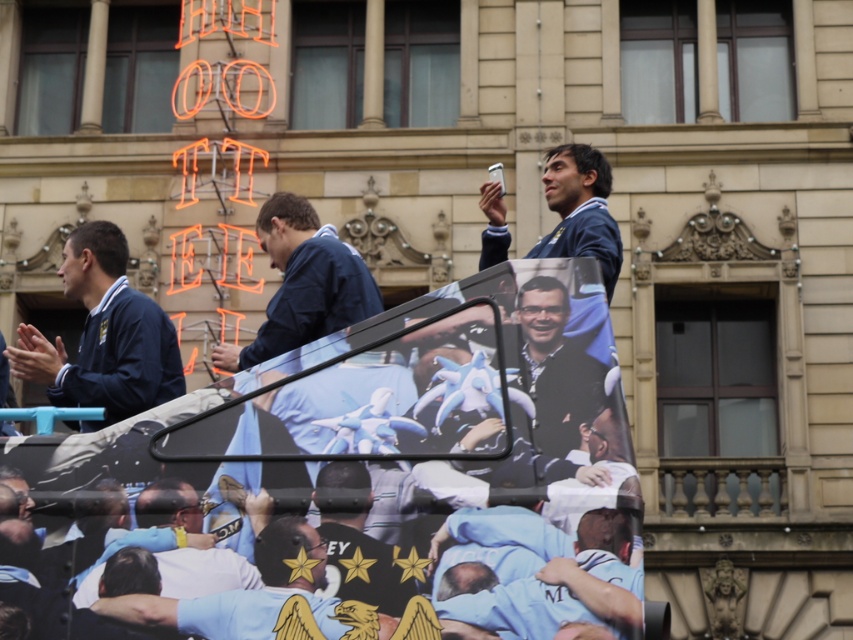
Can you confirm if blue fabric jacket at center is positioned below dark blue shirt at center?

Incorrect, blue fabric jacket at center is not positioned below dark blue shirt at center.

Is blue fabric jacket at center closer to camera compared to dark blue shirt at center?

No, blue fabric jacket at center is further to the viewer.

The width and height of the screenshot is (853, 640). What are the coordinates of `blue fabric jacket at center` in the screenshot? It's located at (302, 284).

Between dark blue shirt at center and blue fabric jacket at upper center, which one has more height?

blue fabric jacket at upper center is taller.

Can you confirm if dark blue shirt at center is positioned to the right of blue fabric jacket at upper center?

In fact, dark blue shirt at center is to the left of blue fabric jacket at upper center.

The image size is (853, 640). In order to click on dark blue shirt at center in this screenshot , I will do `click(556, 364)`.

Measure the distance from blue fabric banner at center to blue fabric jacket at center.

blue fabric banner at center and blue fabric jacket at center are 6.05 meters apart from each other.

This screenshot has height=640, width=853. What do you see at coordinates (357, 481) in the screenshot?
I see `blue fabric banner at center` at bounding box center [357, 481].

Who is more distant from viewer, (x=431, y=394) or (x=357, y=282)?

Positioned behind is point (x=357, y=282).

You are a GUI agent. You are given a task and a screenshot of the screen. Output one action in this format:
    pyautogui.click(x=<x>, y=<y>)
    Task: Click on the blue fabric banner at center
    The image size is (853, 640).
    Given the screenshot: What is the action you would take?
    pyautogui.click(x=357, y=481)